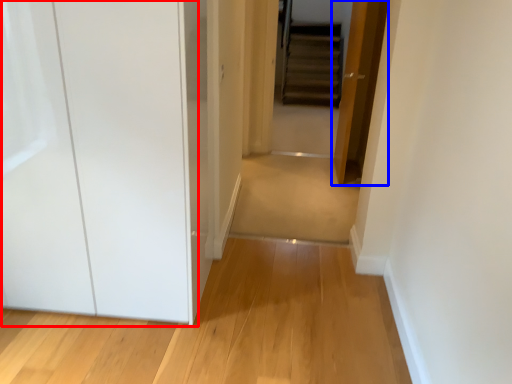
Question: Which of the following is the farthest to the observer, glass door (highlighted by a red box) or door (highlighted by a blue box)?

Choices:
 (A) glass door
 (B) door

Answer: (B)